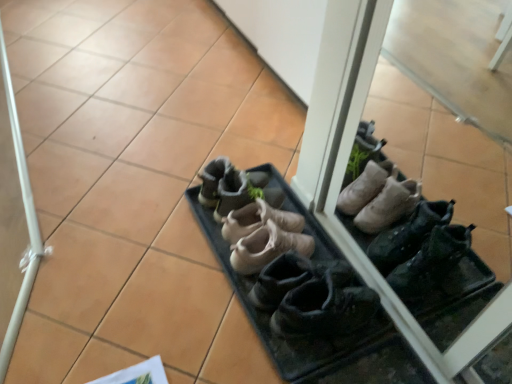
Question: From a real-world perspective, is black leather shoes at center, acting as the 1th footwear starting from the front, physically above leather boots at center, which appears as the first footwear when viewed from the back?

Choices:
 (A) no
 (B) yes

Answer: (B)

Question: From a real-world perspective, is black leather shoes at center, acting as the 1th footwear starting from the front, located beneath leather boots at center, the 5th footwear in the front-to-back sequence?

Choices:
 (A) yes
 (B) no

Answer: (B)

Question: Is black leather shoes at center, arranged as the 5th footwear when viewed from the back, oriented towards leather boots at center, the 5th footwear in the front-to-back sequence?

Choices:
 (A) no
 (B) yes

Answer: (A)

Question: Does black leather shoes at center, acting as the 1th footwear starting from the front, appear on the right side of leather boots at center, the 5th footwear in the front-to-back sequence?

Choices:
 (A) yes
 (B) no

Answer: (A)

Question: Considering the relative sizes of black leather shoes at center, arranged as the 5th footwear when viewed from the back, and leather boots at center, the 5th footwear in the front-to-back sequence, in the image provided, is black leather shoes at center, arranged as the 5th footwear when viewed from the back, smaller than leather boots at center, the 5th footwear in the front-to-back sequence,?

Choices:
 (A) yes
 (B) no

Answer: (B)

Question: In terms of width, does leather boots at center, which appears as the first footwear when viewed from the back, look wider or thinner when compared to leather boots at center, the 2th footwear in the front-to-back sequence?

Choices:
 (A) thin
 (B) wide

Answer: (A)

Question: From a real-world perspective, is leather boots at center, which appears as the first footwear when viewed from the back, above or below leather boots at center, the fourth footwear when ordered from back to front?

Choices:
 (A) above
 (B) below

Answer: (A)

Question: In terms of size, does leather boots at center, the 5th footwear in the front-to-back sequence, appear bigger or smaller than leather boots at center, the fourth footwear when ordered from back to front?

Choices:
 (A) big
 (B) small

Answer: (B)

Question: Is point (246, 172) closer or farther from the camera than point (278, 228)?

Choices:
 (A) closer
 (B) farther

Answer: (B)

Question: Is tan suede shoes at center, which ranks as the 3th footwear in back-to-front order, taller or shorter than black leather shoes at center, arranged as the 5th footwear when viewed from the back?

Choices:
 (A) tall
 (B) short

Answer: (B)

Question: In terms of width, does tan suede shoes at center, the 3th footwear viewed from the front, look wider or thinner when compared to black leather shoes at center, arranged as the 5th footwear when viewed from the back?

Choices:
 (A) thin
 (B) wide

Answer: (A)

Question: Is point (288, 236) positioned closer to the camera than point (280, 306)?

Choices:
 (A) farther
 (B) closer

Answer: (A)

Question: Considering their positions, is tan suede shoes at center, which ranks as the 3th footwear in back-to-front order, located in front of or behind black leather shoes at center, arranged as the 5th footwear when viewed from the back?

Choices:
 (A) behind
 (B) front

Answer: (A)

Question: In terms of size, does black leather shoes at center, arranged as the 5th footwear when viewed from the back, appear bigger or smaller than tan suede shoes at center, which ranks as the 3th footwear in back-to-front order?

Choices:
 (A) small
 (B) big

Answer: (B)

Question: From a real-world perspective, relative to tan suede shoes at center, which ranks as the 3th footwear in back-to-front order, is black leather shoes at center, arranged as the 5th footwear when viewed from the back, vertically above or below?

Choices:
 (A) above
 (B) below

Answer: (A)